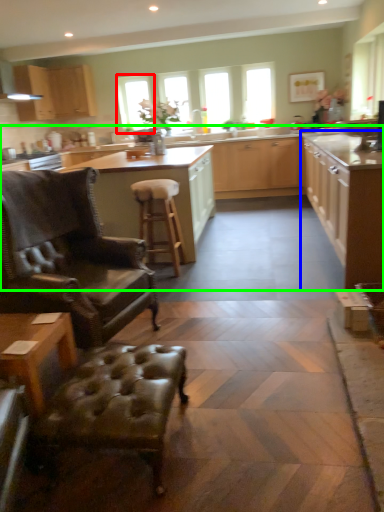
Question: Which object is the closest to the window (highlighted by a red box)? Choose among these: cabinetry (highlighted by a blue box) or cabinetry (highlighted by a green box).

Choices:
 (A) cabinetry
 (B) cabinetry

Answer: (B)